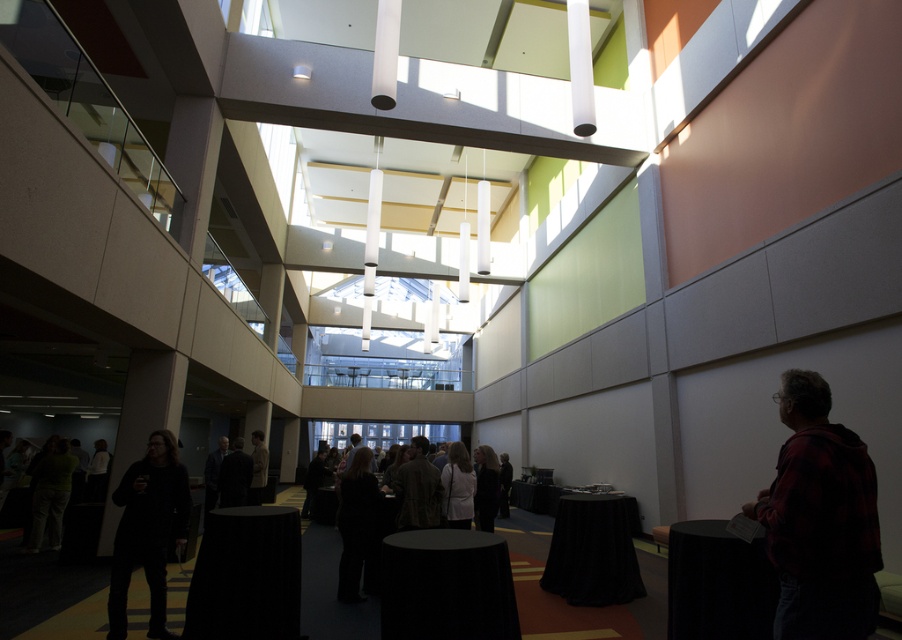
Question: Which point is farther to the camera?

Choices:
 (A) (160, 627)
 (B) (410, 493)
 (C) (459, 524)
 (D) (258, 440)

Answer: (D)

Question: Is dark gray pants at center above dark gray sweater at center?

Choices:
 (A) no
 (B) yes

Answer: (B)

Question: Which point appears farthest from the camera in this image?

Choices:
 (A) (468, 512)
 (B) (267, 458)
 (C) (108, 616)

Answer: (B)

Question: Considering the real-world distances, which object is farthest from the white fabric dress at center?

Choices:
 (A) dark brown leather jacket at center
 (B) light brown fabric jacket at center
 (C) red plaid shirt at lower right

Answer: (B)

Question: Is red plaid shirt at lower right further to the viewer compared to dark brown leather jacket at center?

Choices:
 (A) yes
 (B) no

Answer: (B)

Question: Does red plaid shirt at lower right appear on the right side of light brown fabric jacket at center?

Choices:
 (A) no
 (B) yes

Answer: (B)